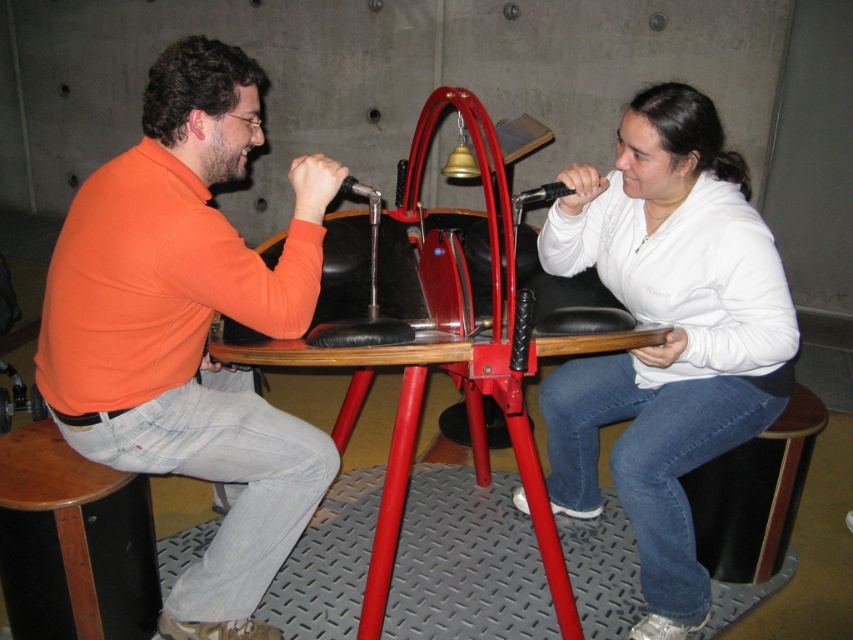
Image resolution: width=853 pixels, height=640 pixels. What do you see at coordinates (190, 330) in the screenshot?
I see `orange cotton shirt at left` at bounding box center [190, 330].

Which of these two, orange cotton shirt at left or white fleece at center, stands taller?

With more height is orange cotton shirt at left.

Locate an element on the screen. The width and height of the screenshot is (853, 640). orange cotton shirt at left is located at coordinates (190, 330).